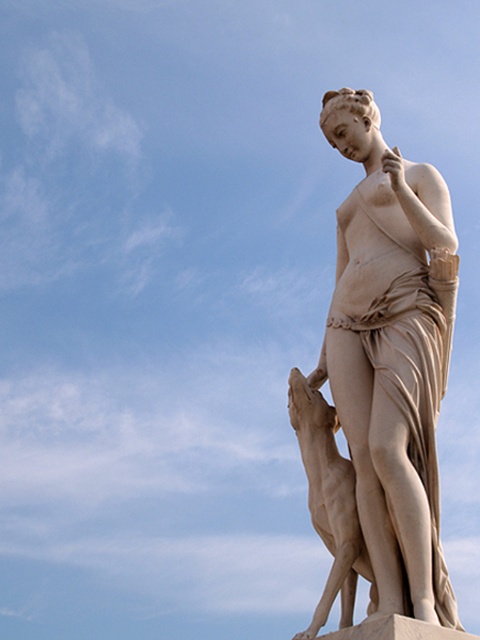
You are standing in a park and see the white marble statue at center. If you want to take a photo of it from the front, which direction should you face?

Since the white marble statue at center is located at point 2D coordinates of (384, 374), you should face the direction where the statue is positioned to capture it from the front. However, without additional information about the park layout or the statue orientation, it is not possible to determine the exact direction to face.

You are an art student who wants to sketch the scene. You need to determine the vertical positioning of the white marble statue at center and the matte stone dog at lower center. Which one is higher in the image?

The white marble statue at center is higher than the matte stone dog at lower center because it is positioned above it.